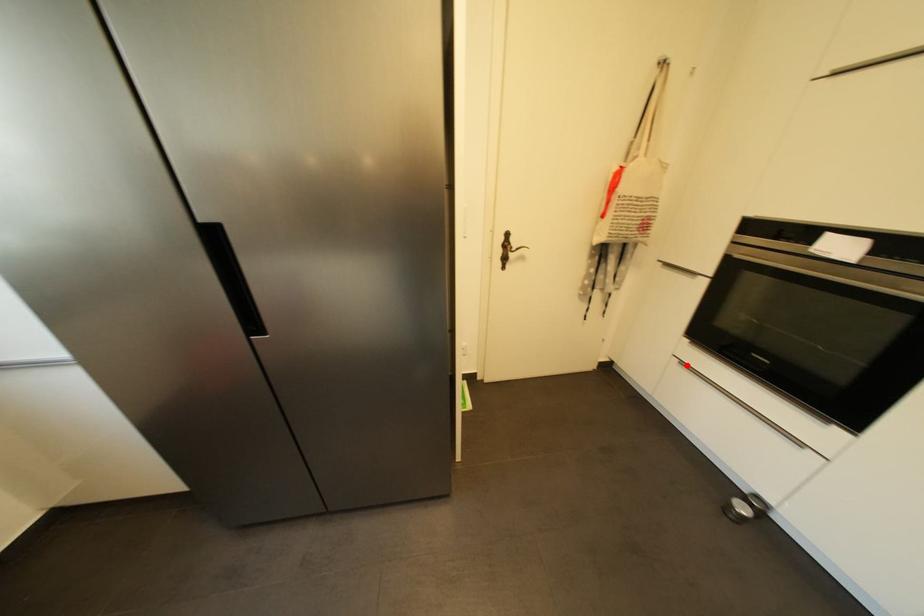
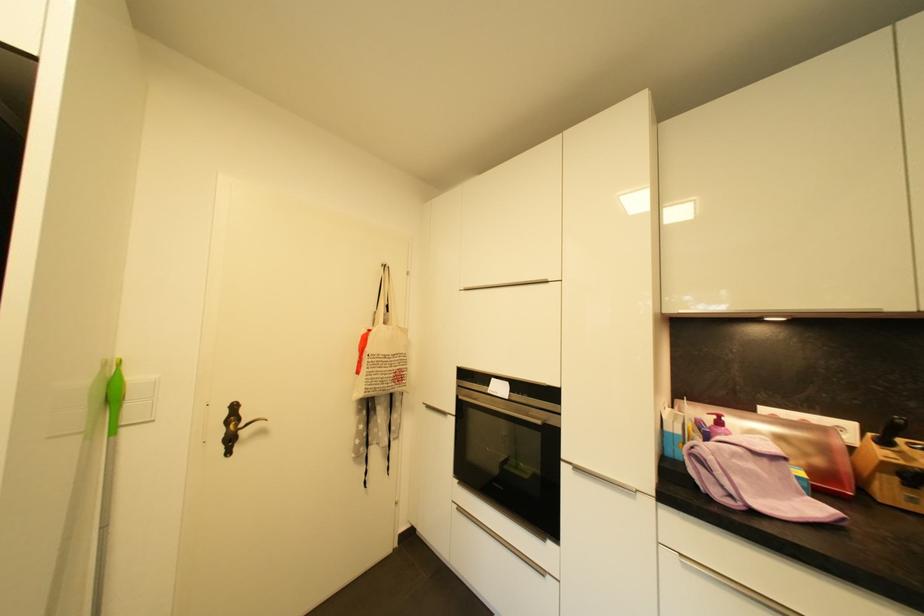
Where in the second image is the point corresponding to the highlighted location from the first image?

(465, 511)